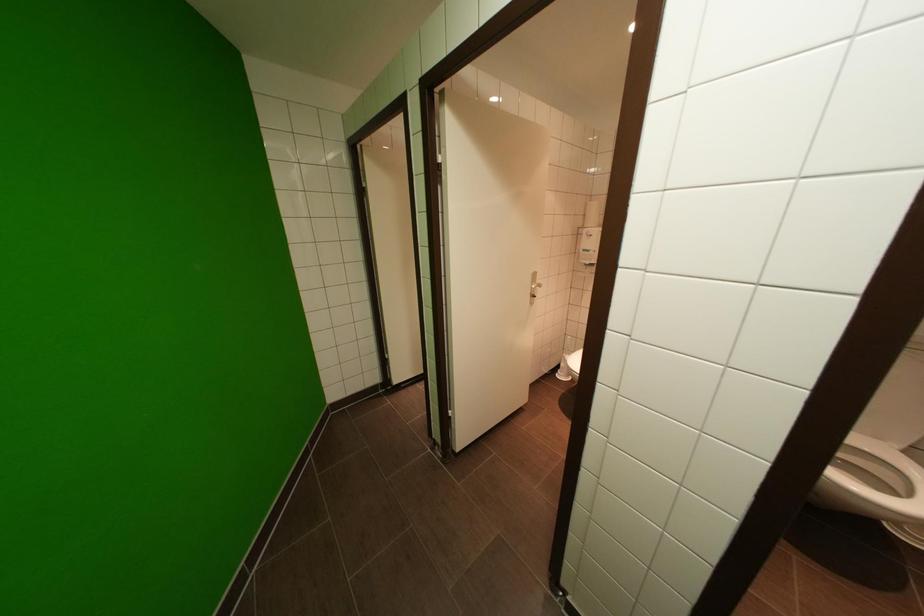
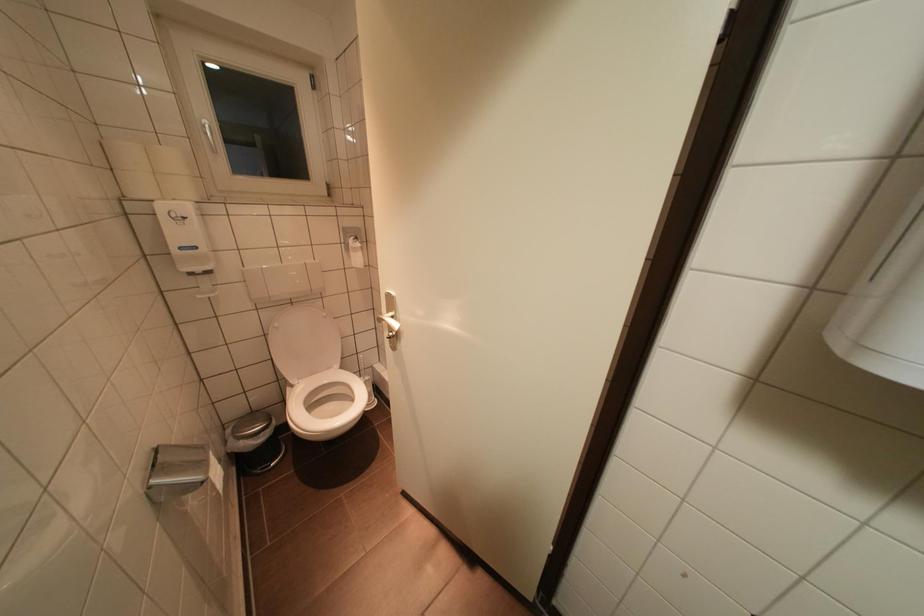
First-person continuous shooting, in which direction is the camera rotating?

The rotation direction of the camera is right-down.